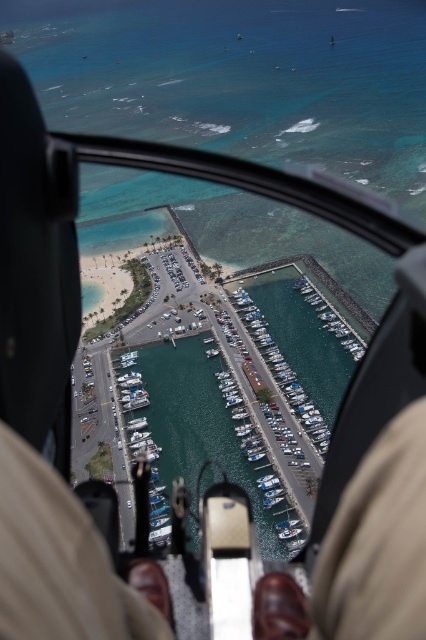
Consider the image. Which is more to the right, brown leather shoes at lower center or white glossy boats at center?

Positioned to the right is white glossy boats at center.

Can you confirm if brown leather shoes at lower center is thinner than white glossy boats at center?

Incorrect, brown leather shoes at lower center's width is not less than white glossy boats at center's.

Where is `brown leather shoes at lower center`? brown leather shoes at lower center is located at coordinates (57, 561).

Who is lower down, white plastic boats at center or white glossy boats at center?

white plastic boats at center

Which is in front, point (247, 330) or point (298, 280)?

Point (247, 330) is more forward.

Image resolution: width=426 pixels, height=640 pixels. Find the location of `white plastic boats at center`. white plastic boats at center is located at coordinates (282, 371).

Measure the distance between point (406, 528) and camera.

Point (406, 528) is 153.27 feet away from camera.

Is brown leather shoes at lower center to the right of white plastic boats at center from the viewer's perspective?

No, brown leather shoes at lower center is not to the right of white plastic boats at center.

Describe the element at coordinates (57, 561) in the screenshot. Image resolution: width=426 pixels, height=640 pixels. I see `brown leather shoes at lower center` at that location.

Locate an element on the screen. brown leather shoes at lower center is located at coordinates (57, 561).